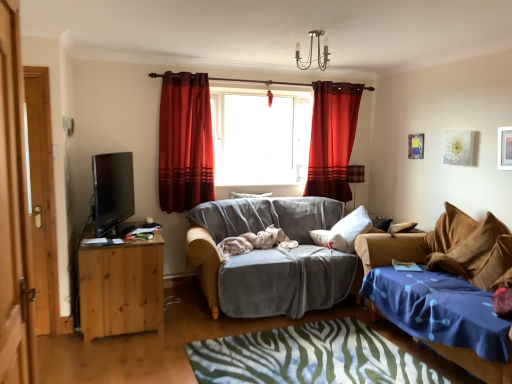
Question: Should I look upward or downward to see velvet blue studio couch at lower right, acting as the 2th studio couch starting from the left?

Choices:
 (A) down
 (B) up

Answer: (A)

Question: Is metallic gold picture frame at upper right, which is the first picture frame from left to right, taller than white soft pillow at center, which appears as the 1th pillow when viewed from the back?

Choices:
 (A) no
 (B) yes

Answer: (B)

Question: Can you confirm if metallic gold picture frame at upper right, the 2th picture frame from the right, is positioned to the left of white soft pillow at center, which appears as the second pillow when ordered from the bottom?

Choices:
 (A) yes
 (B) no

Answer: (B)

Question: Is the surface of metallic gold picture frame at upper right, which is the 1th picture frame in back-to-front order, in direct contact with white soft pillow at center, the second pillow viewed from the right?

Choices:
 (A) yes
 (B) no

Answer: (B)

Question: Considering the relative sizes of metallic gold picture frame at upper right, the 2th picture frame from the right, and white soft pillow at center, which appears as the 1th pillow when viewed from the top, in the image provided, is metallic gold picture frame at upper right, the 2th picture frame from the right, thinner than white soft pillow at center, which appears as the 1th pillow when viewed from the top,?

Choices:
 (A) no
 (B) yes

Answer: (B)

Question: Is metallic gold picture frame at upper right, the 2th picture frame positioned from the front, facing away from white soft pillow at center, which appears as the second pillow when ordered from the bottom?

Choices:
 (A) no
 (B) yes

Answer: (A)

Question: From the image's perspective, is metallic gold picture frame at upper right, which is the 1th picture frame in back-to-front order, on top of white soft pillow at center, placed as the 1th pillow when sorted from left to right?

Choices:
 (A) no
 (B) yes

Answer: (B)

Question: Can you confirm if plaid fabric lampshade at right, placed as the first lamp when sorted from bottom to top, is smaller than metallic chandelier at upper center, placed as the second lamp when sorted from back to front?

Choices:
 (A) no
 (B) yes

Answer: (B)

Question: Are plaid fabric lampshade at right, placed as the first lamp when sorted from bottom to top, and metallic chandelier at upper center, which is the 2th lamp from right to left, beside each other?

Choices:
 (A) yes
 (B) no

Answer: (B)

Question: Is plaid fabric lampshade at right, which is the 2th lamp in top-to-bottom order, shorter than metallic chandelier at upper center, the 1th lamp positioned from the left?

Choices:
 (A) no
 (B) yes

Answer: (A)

Question: Considering the relative sizes of plaid fabric lampshade at right, which is the first lamp in right-to-left order, and metallic chandelier at upper center, the 1th lamp positioned from the left, in the image provided, is plaid fabric lampshade at right, which is the first lamp in right-to-left order, bigger than metallic chandelier at upper center, the 1th lamp positioned from the left,?

Choices:
 (A) no
 (B) yes

Answer: (A)

Question: Does plaid fabric lampshade at right, placed as the first lamp when sorted from bottom to top, appear on the left side of metallic chandelier at upper center, which is the 2th lamp from right to left?

Choices:
 (A) yes
 (B) no

Answer: (B)

Question: From a real-world perspective, is plaid fabric lampshade at right, marked as the 2th lamp in a left-to-right arrangement, positioned over metallic chandelier at upper center, which ranks as the 1th lamp in front-to-back order, based on gravity?

Choices:
 (A) yes
 (B) no

Answer: (B)

Question: Can you confirm if transparent glass window at center is shorter than satin red curtain at center, which is the second curtain from left to right?

Choices:
 (A) yes
 (B) no

Answer: (A)